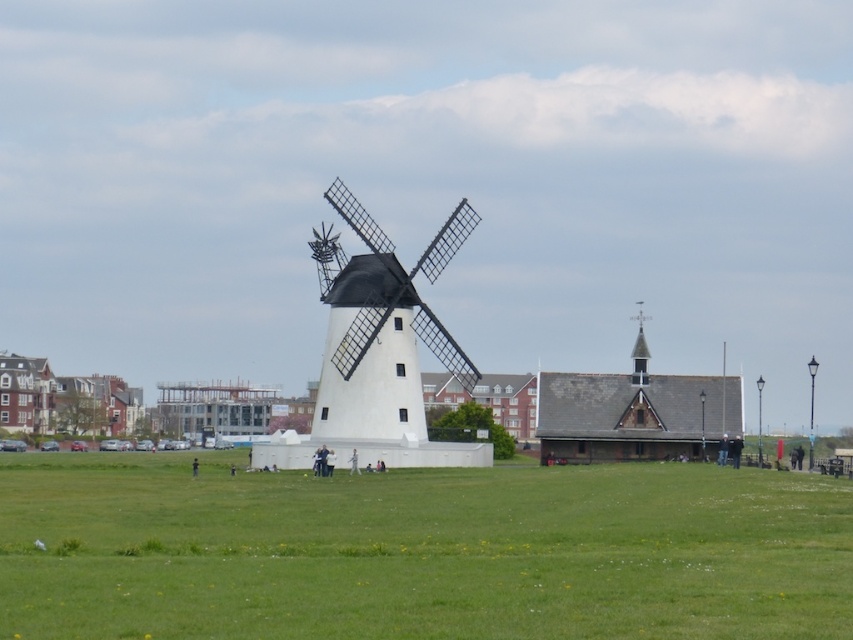
You are standing at the entrance of the field and want to reach the green grass at center. Which direction should you walk to get there?

You should walk towards the center of the field to reach the green grass at center, as it is located at point coordinates indicating the central area.